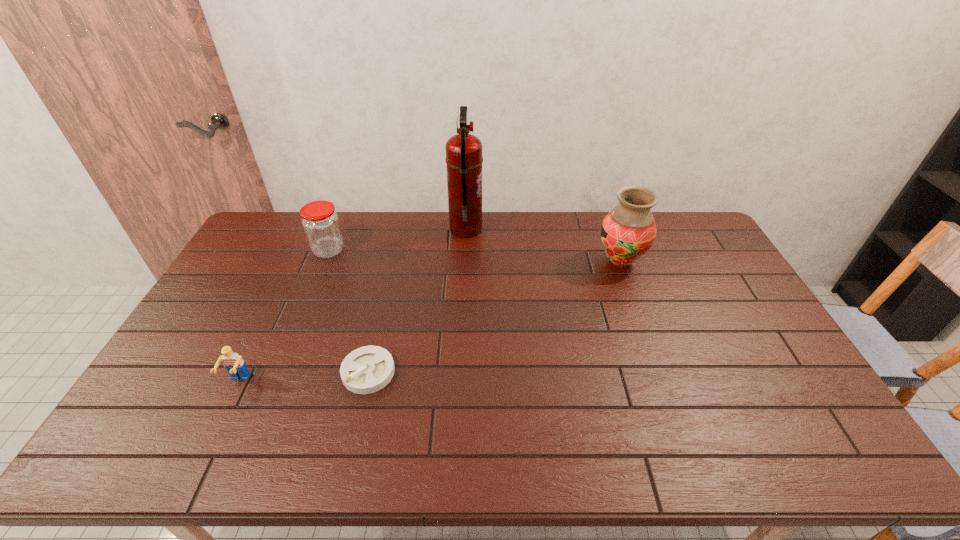
Image resolution: width=960 pixels, height=540 pixels. Identify the location of vacant space at the right edge of the desktop. (800, 394).

This screenshot has width=960, height=540. In order to click on free spot at the far left corner of the desktop in this screenshot , I will do coord(267,212).

In the image, there is a desktop. Identify the location of free space at the far right corner. (679, 240).

Locate an element on the screen. Image resolution: width=960 pixels, height=540 pixels. free space between the Lego and the third shortest object is located at coordinates (283, 316).

Where is `free space between the fourth object from left to right and the second tallest object`? free space between the fourth object from left to right and the second tallest object is located at coordinates (543, 245).

You are a GUI agent. You are given a task and a screenshot of the screen. Output one action in this format:
    pyautogui.click(x=<x>, y=<y>)
    Task: Click on the empty location between the leftmost object and the second object from left to right
    The width and height of the screenshot is (960, 540).
    Given the screenshot: What is the action you would take?
    pyautogui.click(x=283, y=316)

Locate an element on the screen. This screenshot has width=960, height=540. free space that is in between the fourth tallest object and the fourth object from left to right is located at coordinates (352, 305).

Where is `unoccupied position between the second object from left to right and the rightmost object`? This screenshot has height=540, width=960. unoccupied position between the second object from left to right and the rightmost object is located at coordinates (474, 256).

The image size is (960, 540). What are the coordinates of `vacant space that's between the third object from left to right and the fourth tallest object` in the screenshot? It's located at (303, 377).

Identify the location of blank region between the jar and the Lego. The width and height of the screenshot is (960, 540). (283, 316).